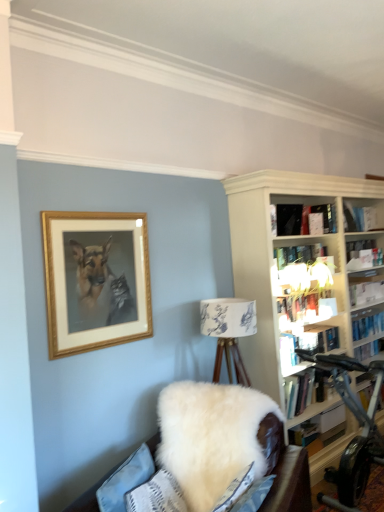
The width and height of the screenshot is (384, 512). Describe the element at coordinates (356, 436) in the screenshot. I see `silver metallic stationary bicycle at right` at that location.

What do you see at coordinates (95, 280) in the screenshot?
I see `wooden picture frame at upper left` at bounding box center [95, 280].

Where is `hardcover book at upper right, marked as the fourth book in a top-to-bottom arrangement`? hardcover book at upper right, marked as the fourth book in a top-to-bottom arrangement is located at coordinates (307, 306).

Are white fluffy couch at lower center and white paper at upper right, which ranks as the 3th book in top-to-bottom order, beside each other?

They are not placed beside each other.

How far apart are white fluffy couch at lower center and white paper at upper right, the fourth book when ordered from bottom to top?

6.88 feet.

From the image's perspective, which is above, white fluffy couch at lower center or white paper at upper right, which ranks as the 3th book in top-to-bottom order?

white paper at upper right, which ranks as the 3th book in top-to-bottom order, appears higher in the image.

Does point (196, 478) come closer to viewer compared to point (366, 298)?

Yes, it is in front of point (366, 298).

Considering the sizes of objects white paper at upper right, the fourth book when ordered from bottom to top, and hardcover book at center-right, which is counted as the fifth book, starting from the top, in the image provided, who is wider, white paper at upper right, the fourth book when ordered from bottom to top, or hardcover book at center-right, which is counted as the fifth book, starting from the top,?

hardcover book at center-right, which is counted as the fifth book, starting from the top, is wider.

Is white paper at upper right, which ranks as the 3th book in top-to-bottom order, closer to camera compared to hardcover book at center-right, which is the second book from bottom to top?

No, white paper at upper right, which ranks as the 3th book in top-to-bottom order, is further to the viewer.

Which point is more distant from viewer, [361,286] or [285,354]?

The point [361,286] is more distant.

Are white paper at upper right, the fourth book when ordered from bottom to top, and hardcover book at center-right, which is the second book from bottom to top, located far from each other?

They are positioned close to each other.

How much distance is there between hardcover book at lower right, which is the 6th book from top to bottom, and hardcover book at center-right, which is counted as the fifth book, starting from the top?

hardcover book at lower right, which is the 6th book from top to bottom, and hardcover book at center-right, which is counted as the fifth book, starting from the top, are 24.06 inches apart from each other.

Which point is more distant from viewer, (295, 437) or (291, 362)?

Point (291, 362)

From a real-world perspective, between hardcover book at lower right, positioned as the first book in bottom-to-top order, and hardcover book at center-right, which is the second book from bottom to top, who is vertically lower?

From a 3D spatial view, hardcover book at lower right, positioned as the first book in bottom-to-top order, is below.

Is hardcover book at lower right, positioned as the first book in bottom-to-top order, not close to hardcover book at center-right, which is counted as the fifth book, starting from the top?

No.

Is silver metallic stationary bicycle at right at the left side of hardcover book at lower right, which is the 6th book from top to bottom?

In fact, silver metallic stationary bicycle at right is to the right of hardcover book at lower right, which is the 6th book from top to bottom.

Is silver metallic stationary bicycle at right aimed at hardcover book at lower right, which is the 6th book from top to bottom?

No, silver metallic stationary bicycle at right is not facing towards hardcover book at lower right, which is the 6th book from top to bottom.

Is silver metallic stationary bicycle at right completely or partially outside of hardcover book at lower right, positioned as the first book in bottom-to-top order?

silver metallic stationary bicycle at right is positioned outside hardcover book at lower right, positioned as the first book in bottom-to-top order.

Does hardcover book at upper right, the third book when ordered from bottom to top, have a greater height compared to wooden picture frame at upper left?

No.

Can you confirm if hardcover book at upper right, marked as the fourth book in a top-to-bottom arrangement, is smaller than wooden picture frame at upper left?

Yes.

Can you see hardcover book at upper right, marked as the fourth book in a top-to-bottom arrangement, touching wooden picture frame at upper left?

There is a gap between hardcover book at upper right, marked as the fourth book in a top-to-bottom arrangement, and wooden picture frame at upper left.

Looking at this image, is hardcover book at upper right, the third book when ordered from bottom to top, facing towards white paper at upper right, the fourth book when ordered from bottom to top?

No, hardcover book at upper right, the third book when ordered from bottom to top, is not turned towards white paper at upper right, the fourth book when ordered from bottom to top.

Is white paper at upper right, which ranks as the 3th book in top-to-bottom order, located within hardcover book at upper right, marked as the fourth book in a top-to-bottom arrangement?

No, white paper at upper right, which ranks as the 3th book in top-to-bottom order, is not surrounded by hardcover book at upper right, marked as the fourth book in a top-to-bottom arrangement.

Based on the photo, from a real-world perspective, who is located lower, hardcover book at upper right, marked as the fourth book in a top-to-bottom arrangement, or white paper at upper right, the fourth book when ordered from bottom to top?

From a 3D spatial view, white paper at upper right, the fourth book when ordered from bottom to top, is below.

Considering the sizes of objects hardcover book at upper right, marked as the fourth book in a top-to-bottom arrangement, and white paper at upper right, which ranks as the 3th book in top-to-bottom order, in the image provided, who is taller, hardcover book at upper right, marked as the fourth book in a top-to-bottom arrangement, or white paper at upper right, which ranks as the 3th book in top-to-bottom order,?

Standing taller between the two is hardcover book at upper right, marked as the fourth book in a top-to-bottom arrangement.

Is white fluffy couch at lower center positioned with its back to hardcover book at upper right, marked as the fourth book in a top-to-bottom arrangement?

Yes, white fluffy couch at lower center's orientation is away from hardcover book at upper right, marked as the fourth book in a top-to-bottom arrangement.

Considering the sizes of white fluffy couch at lower center and hardcover book at upper right, marked as the fourth book in a top-to-bottom arrangement, in the image, is white fluffy couch at lower center wider or thinner than hardcover book at upper right, marked as the fourth book in a top-to-bottom arrangement,?

Clearly, white fluffy couch at lower center has more width compared to hardcover book at upper right, marked as the fourth book in a top-to-bottom arrangement.

Considering the relative sizes of white fluffy couch at lower center and hardcover book at upper right, the third book when ordered from bottom to top, in the image provided, is white fluffy couch at lower center shorter than hardcover book at upper right, the third book when ordered from bottom to top,?

Incorrect, the height of white fluffy couch at lower center does not fall short of that of hardcover book at upper right, the third book when ordered from bottom to top.

Between point (184, 441) and point (325, 298), which one is positioned behind?

Positioned behind is point (325, 298).

This screenshot has width=384, height=512. Find the location of `studio couch lying in front of the white paper at upper right, the fourth book when ordered from bottom to top`. studio couch lying in front of the white paper at upper right, the fourth book when ordered from bottom to top is located at coordinates (209, 436).

From the white paper at upper right, which ranks as the 3th book in top-to-bottom order, count the 3rd book to the left and point to it. Please provide its 2D coordinates.

[(305, 346)]

When comparing their distances from white fluffy couch at lower center, does hardcover book at upper right, marked as the fifth book in a bottom-to-top arrangement, or white paper at upper right, the fourth book when ordered from bottom to top, seem closer?

hardcover book at upper right, marked as the fifth book in a bottom-to-top arrangement, lies closer to white fluffy couch at lower center than the other object.

Considering their positions, is white fluffy couch at lower center positioned closer to hardcover book at center-right, which is the second book from bottom to top, than wooden picture frame at upper left?

white fluffy couch at lower center is positioned closer to the anchor hardcover book at center-right, which is the second book from bottom to top.

When comparing their distances from hardcover book at upper right, marked as the fifth book in a bottom-to-top arrangement, does white paper at upper right, the fourth book when ordered from bottom to top, or black matte book at upper center, which is the first book in top-to-bottom order, seem closer?

Based on the image, black matte book at upper center, which is the first book in top-to-bottom order, appears to be nearer to hardcover book at upper right, marked as the fifth book in a bottom-to-top arrangement.

From the image, which object appears to be farther from hardcover book at lower right, positioned as the first book in bottom-to-top order, white paper at upper right, the fourth book when ordered from bottom to top, or hardcover book at center-right, which is the second book from bottom to top?

white paper at upper right, the fourth book when ordered from bottom to top.

Which object lies nearer to the anchor point white fluffy couch at lower center, hardcover book at upper right, the second book from the top, or silver metallic stationary bicycle at right?

silver metallic stationary bicycle at right lies closer to white fluffy couch at lower center than the other object.

Considering their positions, is silver metallic stationary bicycle at right positioned further to hardcover book at lower right, positioned as the first book in bottom-to-top order, than hardcover book at upper right, the second book from the top?

hardcover book at upper right, the second book from the top, is further to hardcover book at lower right, positioned as the first book in bottom-to-top order.

Looking at the image, which one is located further to black matte book at upper center, which is the 6th book in bottom-to-top order, hardcover book at upper right, marked as the fourth book in a top-to-bottom arrangement, or wooden picture frame at upper left?

Based on the image, wooden picture frame at upper left appears to be further to black matte book at upper center, which is the 6th book in bottom-to-top order.

Considering their positions, is white fluffy couch at lower center positioned further to hardcover book at lower right, which is the 6th book from top to bottom, than silver metallic stationary bicycle at right?

silver metallic stationary bicycle at right lies further to hardcover book at lower right, which is the 6th book from top to bottom, than the other object.

This screenshot has width=384, height=512. I want to click on stationary bicycle between white fluffy couch at lower center and hardcover book at upper right, the third book when ordered from bottom to top, in the front-back direction, so click(x=356, y=436).

At what (x,y) coordinates should I click in order to perform the action: click on studio couch located between wooden picture frame at upper left and hardcover book at upper right, marked as the fourth book in a top-to-bottom arrangement, in the left-right direction. Please return your answer as a coordinate pair (x, y). Looking at the image, I should click on (209, 436).

This screenshot has height=512, width=384. I want to click on studio couch between wooden picture frame at upper left and hardcover book at upper right, marked as the fifth book in a bottom-to-top arrangement, in the horizontal direction, so click(209, 436).

Identify the location of stationary bicycle between white fluffy couch at lower center and hardcover book at lower right, which is the 6th book from top to bottom, in the front-back direction. (356, 436).